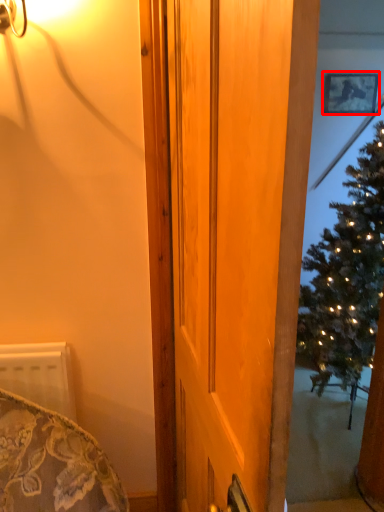
Question: From the image's perspective, considering the relative positions of picture frame (annotated by the red box) and door in the image provided, where is picture frame (annotated by the red box) located with respect to the staircase?

Choices:
 (A) below
 (B) above

Answer: (B)